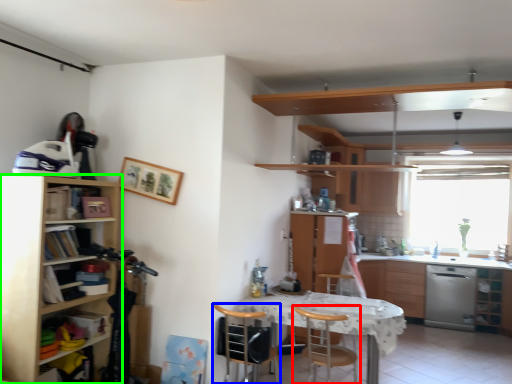
Question: Which object is positioned farthest from chair (highlighted by a red box)? Select from chair (highlighted by a blue box) and cabinetry (highlighted by a green box).

Choices:
 (A) chair
 (B) cabinetry

Answer: (B)